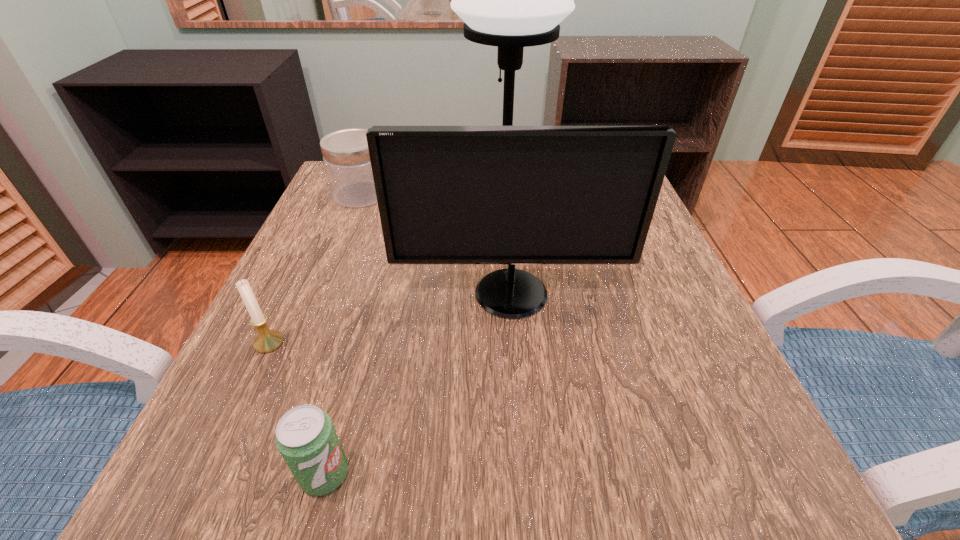
Where is `free region located on the front of the fourth farthest object`? The image size is (960, 540). free region located on the front of the fourth farthest object is located at coordinates (246, 392).

Find the location of a particular element. Image resolution: width=960 pixels, height=540 pixels. free location located on the left of the shortest object is located at coordinates (219, 474).

This screenshot has width=960, height=540. I want to click on table lamp at the far edge, so click(512, 0).

The height and width of the screenshot is (540, 960). Find the location of `jar that is at the far edge`. jar that is at the far edge is located at coordinates (345, 152).

Image resolution: width=960 pixels, height=540 pixels. Identify the location of object that is positioned at the near edge. (305, 437).

Where is `jar present at the left edge`? The width and height of the screenshot is (960, 540). jar present at the left edge is located at coordinates (345, 152).

Locate an element on the screen. The width and height of the screenshot is (960, 540). candle holder that is positioned at the left edge is located at coordinates (267, 340).

At what (x,y) coordinates should I click in order to perform the action: click on soda situated at the left edge. Please return your answer as a coordinate pair (x, y). This screenshot has height=540, width=960. Looking at the image, I should click on (305, 437).

The height and width of the screenshot is (540, 960). What are the coordinates of `object positioned at the right edge` in the screenshot? It's located at (510, 195).

Where is `object that is at the far left corner`? This screenshot has height=540, width=960. object that is at the far left corner is located at coordinates (345, 152).